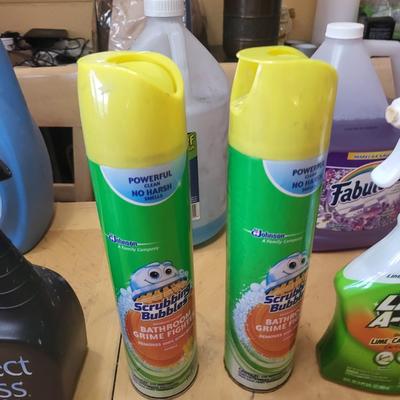
Where is `electrical cords`? electrical cords is located at coordinates (43, 50).